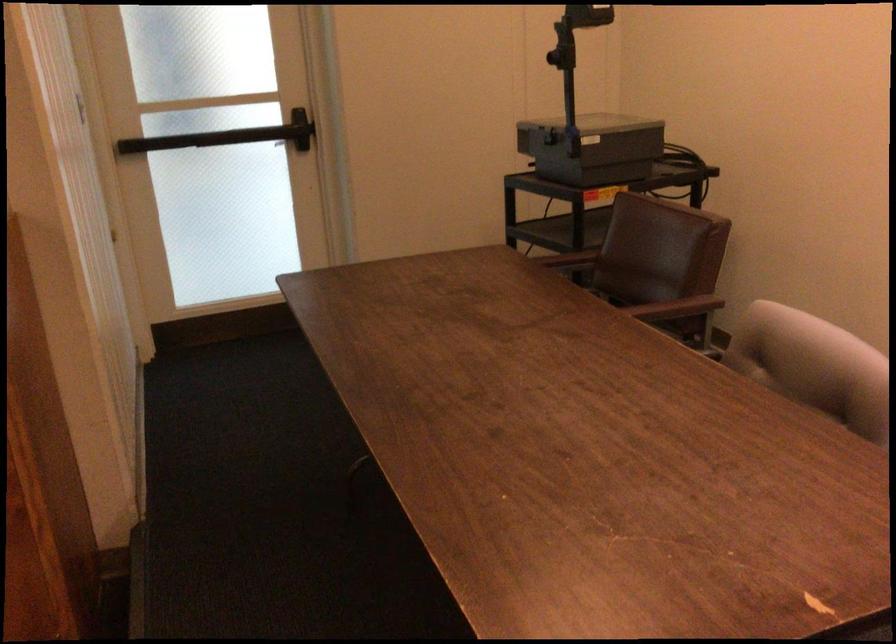
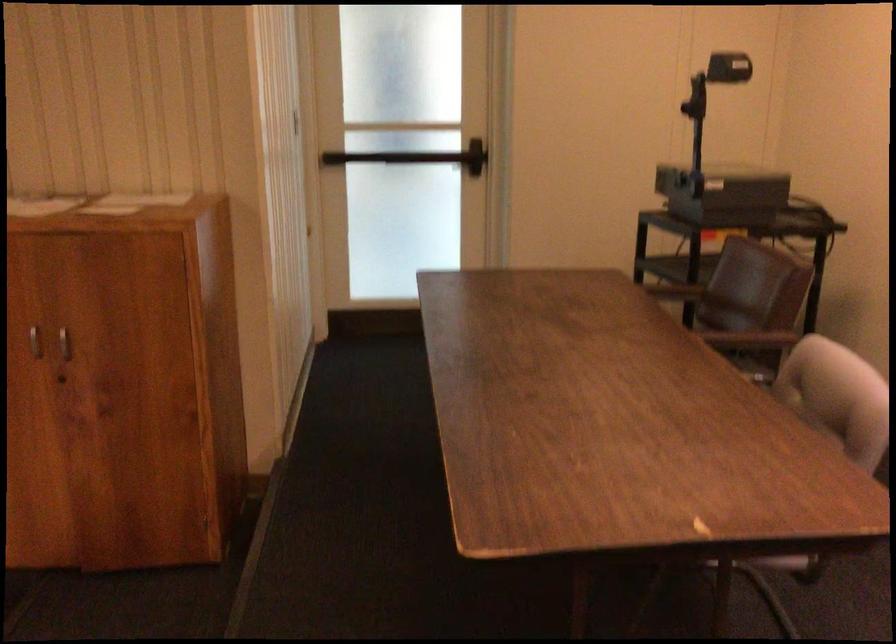
Which direction would the cameraman need to move to produce the second image?

The cameraman walked toward right, backward.